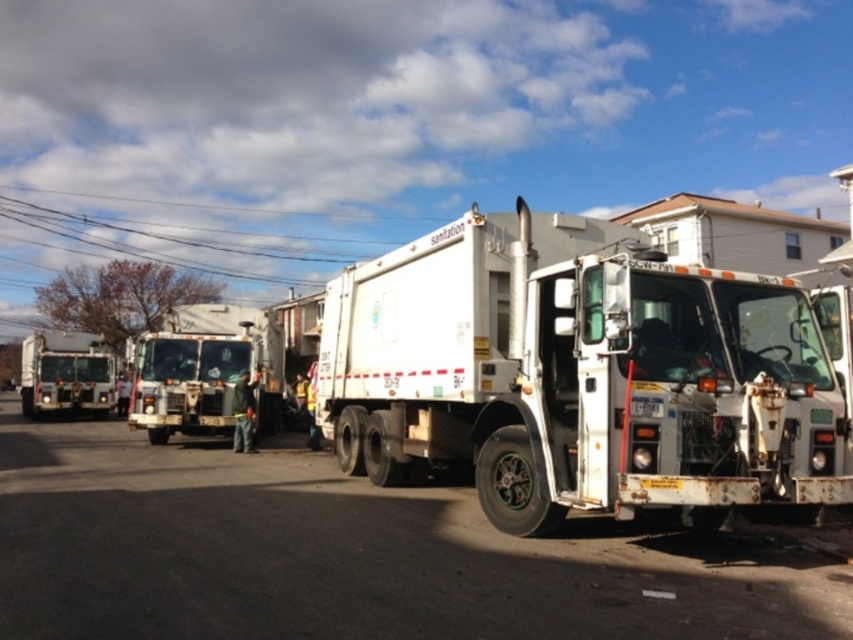
Who is shorter, white matte garbage truck at center or white glossy garbage truck at left?

With less height is white glossy garbage truck at left.

Can you confirm if white matte garbage truck at center is wider than white glossy garbage truck at left?

No.

Is point (160, 442) farther from camera compared to point (62, 371)?

No, it is in front of (62, 371).

Identify the location of white matte garbage truck at center. (206, 371).

Which is more to the left, white matte sanitation truck at center or white matte garbage truck at center?

white matte garbage truck at center is more to the left.

Does point (682, 410) come in front of point (170, 323)?

Yes, it is.

Where is `white matte sanitation truck at center`? white matte sanitation truck at center is located at coordinates (579, 376).

In the scene shown: Is white matte sanitation truck at center taller than white glossy garbage truck at left?

Indeed, white matte sanitation truck at center has a greater height compared to white glossy garbage truck at left.

What do you see at coordinates (579, 376) in the screenshot?
I see `white matte sanitation truck at center` at bounding box center [579, 376].

The height and width of the screenshot is (640, 853). In order to click on white matte sanitation truck at center in this screenshot , I will do `click(579, 376)`.